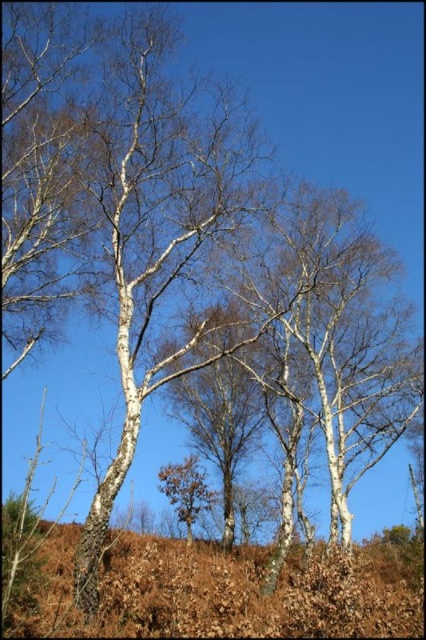
Question: Can you confirm if brown dry grass at lower center is smaller than brown rough tree at center?

Choices:
 (A) no
 (B) yes

Answer: (A)

Question: Among these points, which one is nearest to the camera?

Choices:
 (A) pyautogui.click(x=193, y=509)
 (B) pyautogui.click(x=121, y=586)

Answer: (B)

Question: Which point is closer to the camera taking this photo?

Choices:
 (A) (184, 496)
 (B) (40, 577)

Answer: (B)

Question: Which object appears closest to the camera in this image?

Choices:
 (A) brown dry grass at lower center
 (B) brown rough tree at center

Answer: (A)

Question: Can you confirm if brown dry grass at lower center is positioned to the right of brown rough tree at center?

Choices:
 (A) no
 (B) yes

Answer: (B)

Question: Is brown dry grass at lower center positioned at the back of brown rough tree at center?

Choices:
 (A) no
 (B) yes

Answer: (A)